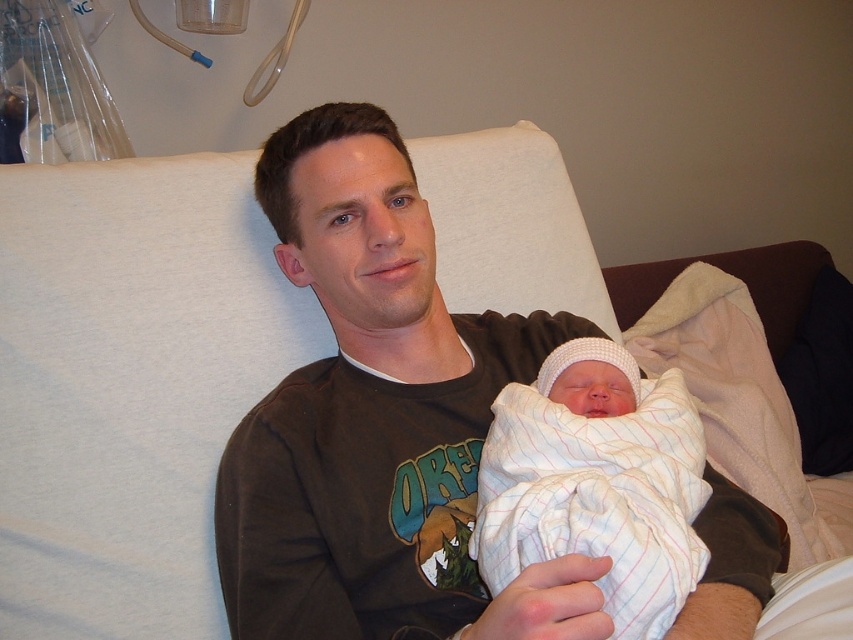
Based on the photo, you are a nurse in a hospital room and need to check the baby in the white striped swaddle at center. Can you easily access the baby without moving the brown cotton shirt at center?

The brown cotton shirt at center is positioned over the white striped swaddle at center, so you would need to move the shirt to access the baby.